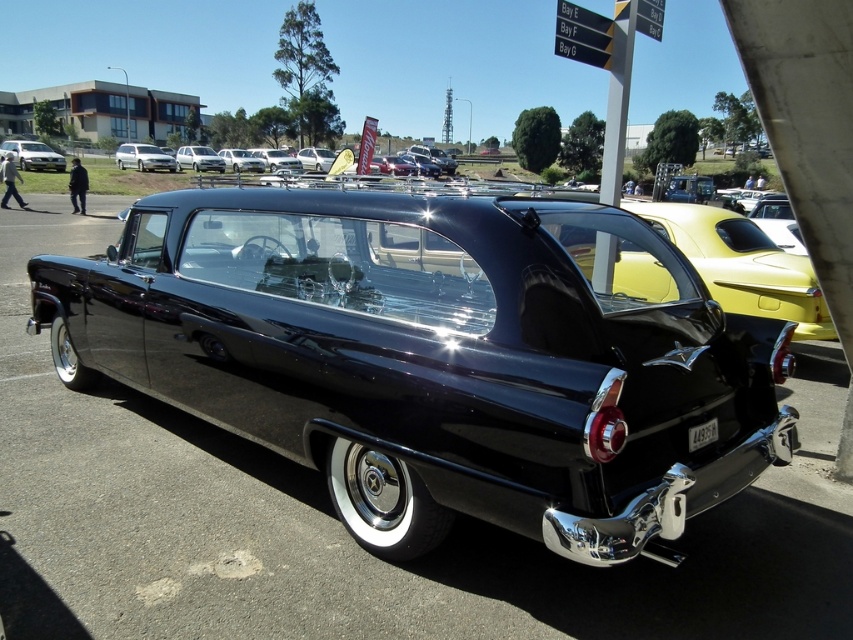
You are a photographer at the car exhibition and want to capture both the white glossy sedan at upper left and the shiny silver sedan at center in a single shot. Based on their positions, which sedan should you focus on first to ensure both are in frame?

The white glossy sedan at upper left is below the shiny silver sedan at center, so you should focus on the shiny silver sedan at center first to ensure both are in frame.

You are a photographer trying to capture a wide shot of the matte white car at upper left and the white glossy sedan at upper left. Your camera can only focus on objects within a 5 meter range. Can you capture both cars in one shot without moving the camera?

The matte white car at upper left is 5.68 meters from the white glossy sedan at upper left. Since the distance between them exceeds the camera focus range of 5 meters, you cannot capture both cars in one shot without moving the camera.

You are a photographer at a car exhibition. You need to capture a photo that includes both the glossy black sedan at center and the shiny silver sedan at center. Given that your camera frame can only accommodate vehicles up to the length of the longer one, which sedan should be positioned closer to the edge of the frame to ensure both fit?

The glossy black sedan at center is shorter than the shiny silver sedan at center. To fit both within the camera frame, position the glossy black sedan at center closer to the edge so that the longer shiny silver sedan at center occupies the main space without exceeding the frame limits.